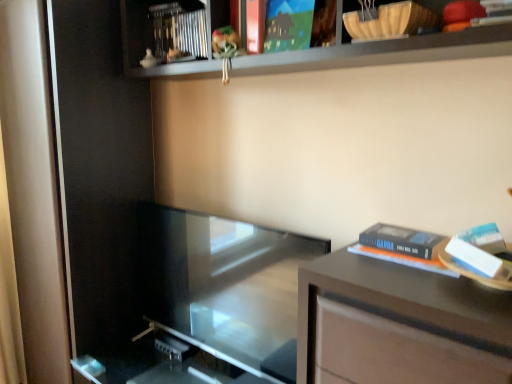
In order to click on vacant area on top of hardcover book at right, the 1th paperback book viewed from the right (from a real-world perspective) in this screenshot , I will do `click(411, 238)`.